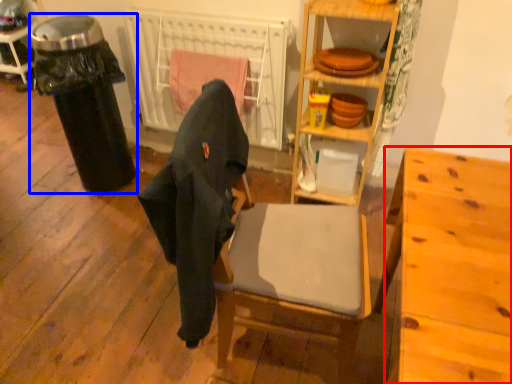
Question: Among these objects, which one is nearest to the camera, desk (highlighted by a red box) or garbage (highlighted by a blue box)?

Choices:
 (A) desk
 (B) garbage

Answer: (A)